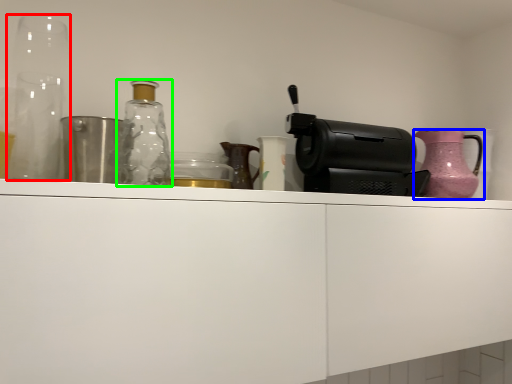
Question: Based on their relative distances, which object is nearer to glass vase (highlighted by a red box)? Choose from jug (highlighted by a blue box) and bottle (highlighted by a green box).

Choices:
 (A) jug
 (B) bottle

Answer: (B)